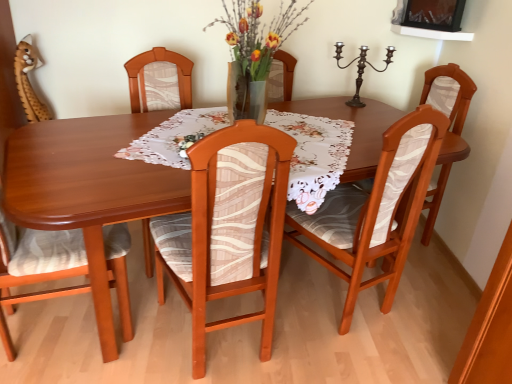
Describe the element at coordinates (376, 209) in the screenshot. I see `wooden chair at center, which is the fourth chair from left to right` at that location.

In order to face wooden chair at center, acting as the second chair starting from the left, should I rotate leftwards or rightwards?

You should rotate left by 10.404 degrees.

The width and height of the screenshot is (512, 384). In order to click on brown plush toy at upper left in this screenshot , I will do `click(28, 81)`.

At what (x,y) coordinates should I click in order to perform the action: click on wooden chair at right, which is counted as the 5th chair, starting from the left. Please return your answer as a coordinate pair (x, y). The width and height of the screenshot is (512, 384). Looking at the image, I should click on click(449, 94).

The image size is (512, 384). Describe the element at coordinates (39, 260) in the screenshot. I see `matte wood chair at left, the first chair viewed from the left` at that location.

At what (x,y) coordinates should I click in order to perform the action: click on bronze metallic candle holder at upper right. Please return your answer as a coordinate pair (x, y). Image resolution: width=512 pixels, height=384 pixels. Looking at the image, I should click on (361, 69).

From the image's perspective, between wooden chair with patterned fabric at center, which ranks as the 3th chair in right-to-left order, and wooden chair at center, acting as the second chair starting from the left, who is located below?

From the image's view, wooden chair with patterned fabric at center, which ranks as the 3th chair in right-to-left order, is below.

In the scene shown: Which object is closer to the camera, wooden chair with patterned fabric at center, which ranks as the 3th chair in right-to-left order, or wooden chair at center, marked as the fourth chair in a right-to-left arrangement?

wooden chair with patterned fabric at center, which ranks as the 3th chair in right-to-left order, is more forward.

Looking at the image, does wooden chair with patterned fabric at center, which ranks as the 3th chair in right-to-left order, seem bigger or smaller compared to wooden chair at center, marked as the fourth chair in a right-to-left arrangement?

Considering their sizes, wooden chair with patterned fabric at center, which ranks as the 3th chair in right-to-left order, takes up less space than wooden chair at center, marked as the fourth chair in a right-to-left arrangement.

Image resolution: width=512 pixels, height=384 pixels. What are the coordinates of `the 1st chair to the left of the wooden chair with patterned fabric at center, which ranks as the 3th chair in right-to-left order, starting your count from the anchor` in the screenshot? It's located at (159, 81).

From the image's perspective, would you say wooden chair at right, which is the 1th chair from right to left, is positioned over wooden chair with patterned fabric at center, which ranks as the 3th chair in right-to-left order?

Yes, from the image's perspective, wooden chair at right, which is the 1th chair from right to left, is on top of wooden chair with patterned fabric at center, which ranks as the 3th chair in right-to-left order.

From a real-world perspective, relative to wooden chair with patterned fabric at center, which ranks as the 3th chair in right-to-left order, is wooden chair at right, which is the 1th chair from right to left, vertically above or below?

Clearly, from a real-world perspective, wooden chair at right, which is the 1th chair from right to left, is above wooden chair with patterned fabric at center, which ranks as the 3th chair in right-to-left order.

Is wooden chair with patterned fabric at center, placed as the third chair when sorted from left to right, a part of wooden chair at right, which is the 1th chair from right to left?

No, wooden chair at right, which is the 1th chair from right to left, does not contain wooden chair with patterned fabric at center, placed as the third chair when sorted from left to right.

Can you confirm if wooden chair at right, which is counted as the 5th chair, starting from the left, is positioned to the left of wooden chair with patterned fabric at center, which ranks as the 3th chair in right-to-left order?

No.

Can you confirm if brown plush toy at upper left is smaller than wooden chair at right, which is the 1th chair from right to left?

Correct, brown plush toy at upper left occupies less space than wooden chair at right, which is the 1th chair from right to left.

Would you say wooden chair at right, which is the 1th chair from right to left, is part of brown plush toy at upper left's contents?

No, wooden chair at right, which is the 1th chair from right to left, is not inside brown plush toy at upper left.

Between brown plush toy at upper left and wooden chair at right, which is counted as the 5th chair, starting from the left, which one has more height?

Standing taller between the two is wooden chair at right, which is counted as the 5th chair, starting from the left.

Is brown plush toy at upper left inside wooden table at center?

That's incorrect, brown plush toy at upper left is not inside wooden table at center.

How different are the orientations of wooden table at center and brown plush toy at upper left in degrees?

130 degrees separate the facing orientations of wooden table at center and brown plush toy at upper left.

Who is more distant, wooden table at center or brown plush toy at upper left?

brown plush toy at upper left is further from the camera.

Between point (95, 139) and point (25, 79), which one is positioned in front?

Positioned in front is point (95, 139).

Which of these two, wooden chair with patterned fabric at center, placed as the third chair when sorted from left to right, or wooden chair at right, which is the 1th chair from right to left, is thinner?

wooden chair with patterned fabric at center, placed as the third chair when sorted from left to right.

Is wooden chair with patterned fabric at center, placed as the third chair when sorted from left to right, facing away from wooden chair at right, which is counted as the 5th chair, starting from the left?

No, wooden chair with patterned fabric at center, placed as the third chair when sorted from left to right, is not facing away from wooden chair at right, which is counted as the 5th chair, starting from the left.

Is wooden chair with patterned fabric at center, placed as the third chair when sorted from left to right, taller or shorter than wooden chair at right, which is the 1th chair from right to left?

In the image, wooden chair with patterned fabric at center, placed as the third chair when sorted from left to right, appears to be taller than wooden chair at right, which is the 1th chair from right to left.

Measure the distance between wooden chair with patterned fabric at center, placed as the third chair when sorted from left to right, and wooden chair at right, which is counted as the 5th chair, starting from the left.

wooden chair with patterned fabric at center, placed as the third chair when sorted from left to right, and wooden chair at right, which is counted as the 5th chair, starting from the left, are 1.33 meters apart from each other.

Is matte wood chair at left, the first chair viewed from the left, in contact with floral lace tablecloth at center?

No, matte wood chair at left, the first chair viewed from the left, is not next to floral lace tablecloth at center.

From a real-world perspective, who is located lower, matte wood chair at left, the first chair viewed from the left, or floral lace tablecloth at center?

From a 3D spatial view, matte wood chair at left, the first chair viewed from the left, is below.

Between matte wood chair at left, the 5th chair viewed from the right, and floral lace tablecloth at center, which one is positioned behind?

floral lace tablecloth at center is further away from the camera.

Considering the relative sizes of matte wood chair at left, the first chair viewed from the left, and floral lace tablecloth at center in the image provided, is matte wood chair at left, the first chair viewed from the left, wider than floral lace tablecloth at center?

No, matte wood chair at left, the first chair viewed from the left, is not wider than floral lace tablecloth at center.

Choose the correct answer: Is wooden chair with patterned fabric at center, placed as the third chair when sorted from left to right, inside wooden chair at center, which is the fourth chair from left to right, or outside it?

wooden chair with patterned fabric at center, placed as the third chair when sorted from left to right, is outside wooden chair at center, which is the fourth chair from left to right.

Can you confirm if wooden chair with patterned fabric at center, placed as the third chair when sorted from left to right, is taller than wooden chair at center, which is the fourth chair from left to right?

Yes.

Considering the sizes of objects wooden chair with patterned fabric at center, placed as the third chair when sorted from left to right, and wooden chair at center, the 2th chair viewed from the right, in the image provided, who is thinner, wooden chair with patterned fabric at center, placed as the third chair when sorted from left to right, or wooden chair at center, the 2th chair viewed from the right,?

wooden chair with patterned fabric at center, placed as the third chair when sorted from left to right.

Measure the distance between wooden chair with patterned fabric at center, which ranks as the 3th chair in right-to-left order, and wooden chair at center, the 2th chair viewed from the right.

48.63 centimeters.

Which chair is the 2nd one when counting from the front of the wooden chair at center, marked as the fourth chair in a right-to-left arrangement? Please provide its 2D coordinates.

[(228, 228)]

From the image's perspective, which chair is the 4th one below the wooden chair at right, which is the 1th chair from right to left? Please provide its 2D coordinates.

[(228, 228)]

Estimate the real-world distances between objects in this image. Which object is further from wooden table at center, wooden chair with patterned fabric at center, which ranks as the 3th chair in right-to-left order, or wooden chair at center, which is the fourth chair from left to right?

wooden chair at center, which is the fourth chair from left to right, is further to wooden table at center.

From the image, which object appears to be farther from wooden chair at center, the 2th chair viewed from the right, floral lace tablecloth at center or wooden chair at right, which is counted as the 5th chair, starting from the left?

wooden chair at right, which is counted as the 5th chair, starting from the left, lies further to wooden chair at center, the 2th chair viewed from the right, than the other object.

Looking at this image, from the image, which object appears to be nearer to bronze metallic candle holder at upper right, floral lace tablecloth at center or wooden chair at right, which is counted as the 5th chair, starting from the left?

Among the two, wooden chair at right, which is counted as the 5th chair, starting from the left, is located nearer to bronze metallic candle holder at upper right.

Looking at the image, which one is located closer to wooden chair with patterned fabric at center, which ranks as the 3th chair in right-to-left order, wooden table at center or floral lace tablecloth at center?

wooden table at center.

Considering their positions, is wooden chair at center, which is the fourth chair from left to right, positioned further to wooden table at center than floral lace tablecloth at center?

wooden chair at center, which is the fourth chair from left to right, is positioned further to the anchor wooden table at center.

Estimate the real-world distances between objects in this image. Which object is closer to wooden chair at center, acting as the second chair starting from the left, wooden table at center or bronze metallic candle holder at upper right?

Among the two, wooden table at center is located nearer to wooden chair at center, acting as the second chair starting from the left.

Based on their spatial positions, is wooden chair at center, which is the fourth chair from left to right, or matte wood chair at left, the 5th chair viewed from the right, further from brown plush toy at upper left?

wooden chair at center, which is the fourth chair from left to right.

Considering their positions, is wooden chair at right, which is the 1th chair from right to left, positioned closer to matte wood chair at left, the 5th chair viewed from the right, than brown plush toy at upper left?

Based on the image, brown plush toy at upper left appears to be nearer to matte wood chair at left, the 5th chair viewed from the right.

Locate an element on the screen. candle holder between brown plush toy at upper left and wooden chair at right, which is the 1th chair from right to left, from left to right is located at coordinates (361, 69).

The image size is (512, 384). In order to click on chair situated between floral lace tablecloth at center and wooden chair at right, which is the 1th chair from right to left, from left to right in this screenshot , I will do tap(376, 209).

I want to click on chair between wooden chair with patterned fabric at center, placed as the third chair when sorted from left to right, and wooden chair at right, which is counted as the 5th chair, starting from the left, in the horizontal direction, so click(x=376, y=209).

What are the coordinates of `kitchen & dining room table between wooden chair with patterned fabric at center, placed as the third chair when sorted from left to right, and wooden chair at right, which is counted as the 5th chair, starting from the left, in the horizontal direction` in the screenshot? It's located at (89, 188).